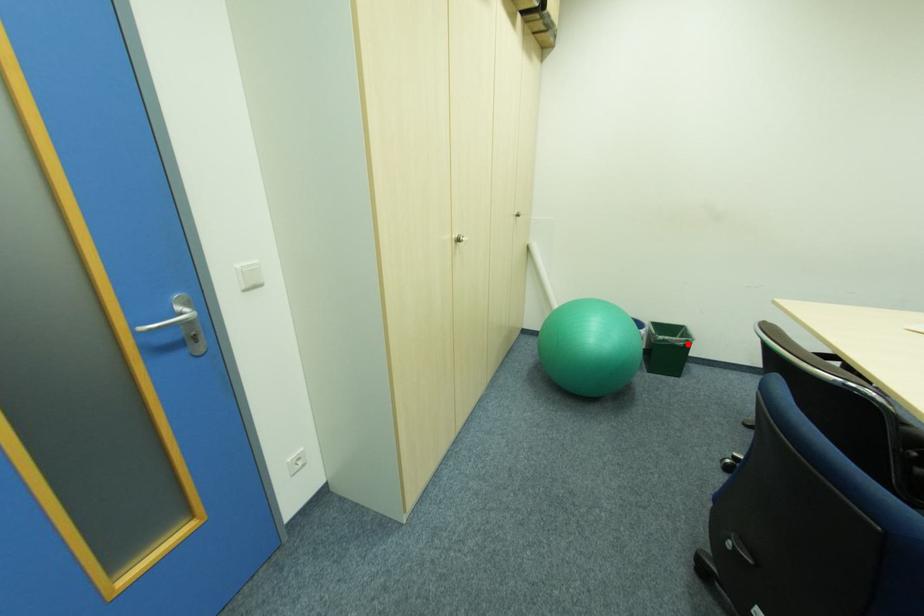
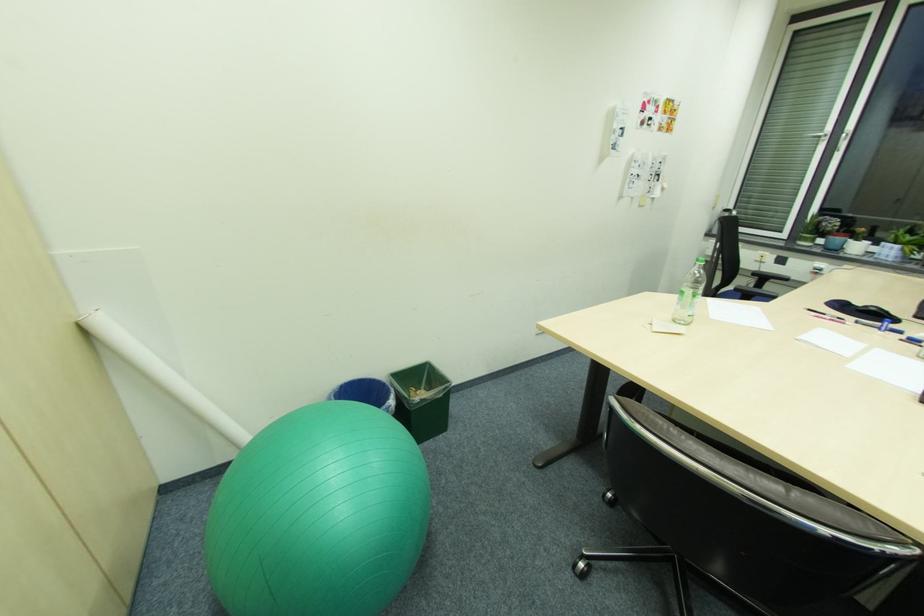
The point at the highlighted location is marked in the first image. Where is the corresponding point in the second image?

(447, 395)